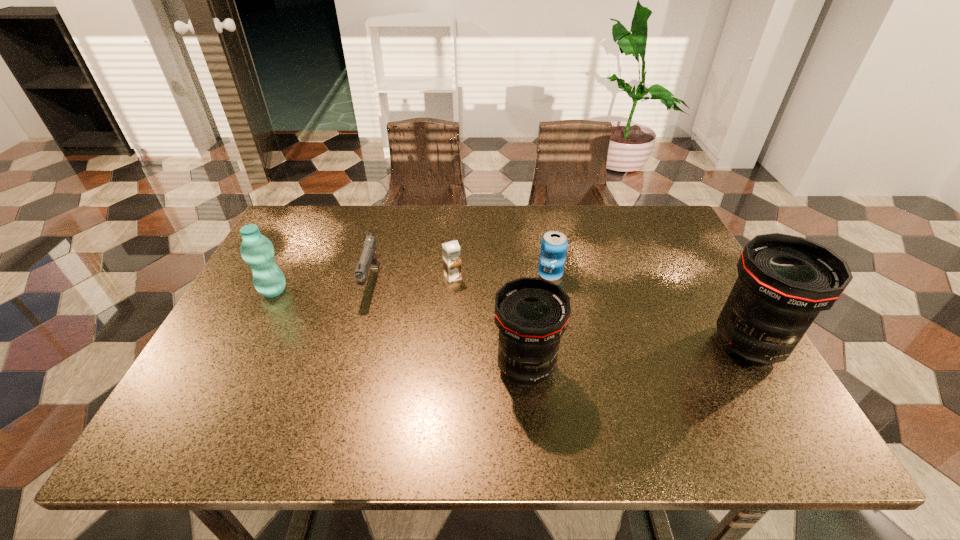
Find the location of a particular element. free space at the far left corner of the desktop is located at coordinates (302, 221).

Where is `free space at the far right corner of the desktop`? This screenshot has height=540, width=960. free space at the far right corner of the desktop is located at coordinates (651, 226).

The width and height of the screenshot is (960, 540). I want to click on free space between the gun and the leftmost object, so click(x=323, y=286).

Where is `unoccupied position between the chocolate milk and the right telephoto lens`? unoccupied position between the chocolate milk and the right telephoto lens is located at coordinates (600, 311).

The image size is (960, 540). Find the location of `vacant area that lies between the fifth object from right to left and the chocolate milk`. vacant area that lies between the fifth object from right to left and the chocolate milk is located at coordinates 412,279.

Find the location of `vacant area that lies between the gun and the leftmost object`. vacant area that lies between the gun and the leftmost object is located at coordinates (323, 286).

You are a GUI agent. You are given a task and a screenshot of the screen. Output one action in this format:
    pyautogui.click(x=<x>, y=<y>)
    Task: Click on the free space that is in between the soda can and the chocolate milk
    
    Given the screenshot: What is the action you would take?
    pyautogui.click(x=501, y=276)

Find the location of `unoccupied area between the soda can and the fourth object from right to left`. unoccupied area between the soda can and the fourth object from right to left is located at coordinates (501, 276).

Locate which object is the fifth closest to the chocolate milk. Please provide its 2D coordinates. Your answer should be formatted as a tuple, i.e. [(x, y)], where the tuple contains the x and y coordinates of a point satisfying the conditions above.

[(784, 281)]

The image size is (960, 540). What are the coordinates of `object that is the fifth closest to the chocolate milk` in the screenshot? It's located at (784, 281).